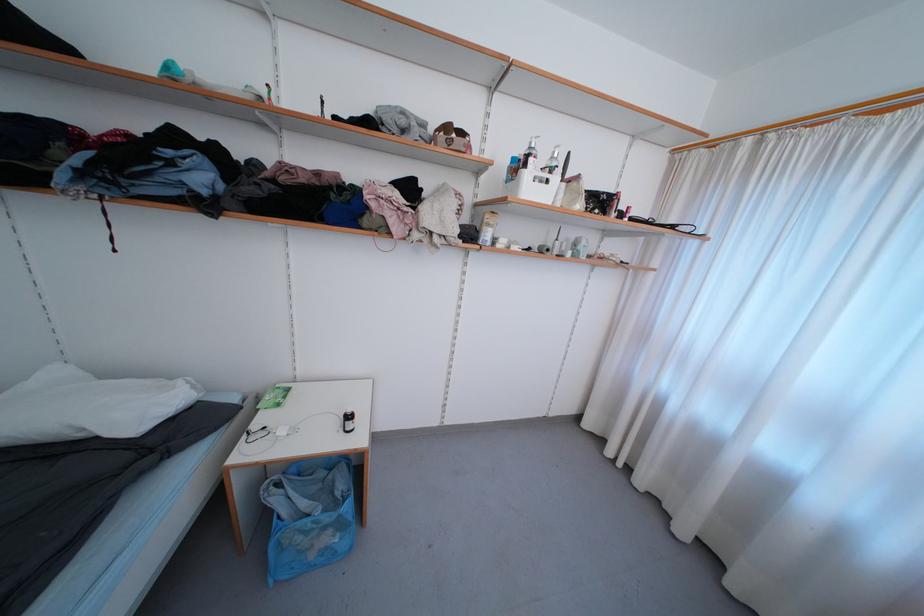
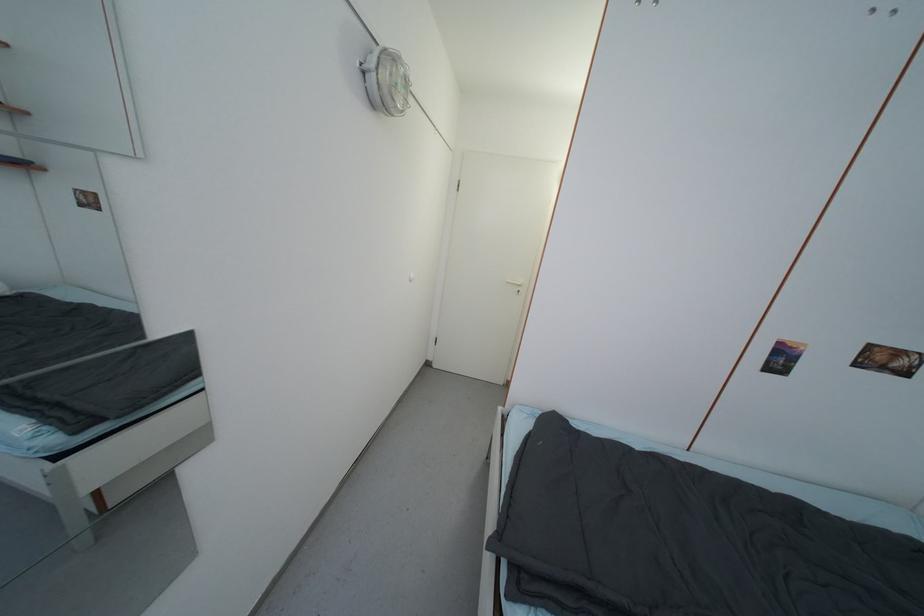
How did the camera likely rotate?

The rotation direction of the camera is left-down.